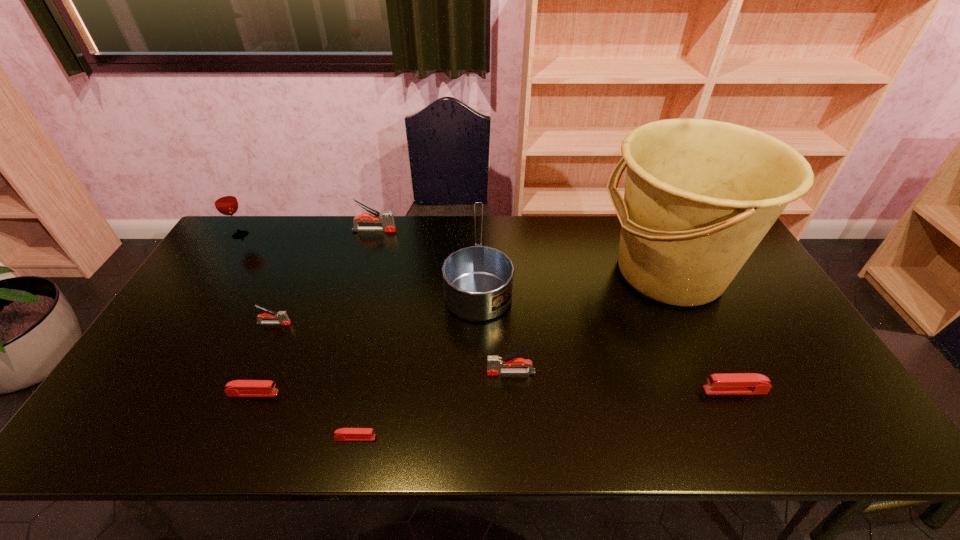
At what (x,y) coordinates should I click in order to perform the action: click on the seventh tallest object. Please return your answer as a coordinate pair (x, y). Looking at the image, I should click on (732, 383).

The image size is (960, 540). Identify the location of the biggest red stapler. (732, 383).

This screenshot has height=540, width=960. I want to click on the leftmost red stapler, so click(x=238, y=388).

At what (x,y) coordinates should I click in order to perform the action: click on the eighth tallest object. Please return your answer as a coordinate pair (x, y). The image size is (960, 540). Looking at the image, I should click on (238, 388).

Find the location of a particular element. The width and height of the screenshot is (960, 540). the shortest object is located at coordinates (343, 434).

Image resolution: width=960 pixels, height=540 pixels. Find the location of `the nearest red stapler`. the nearest red stapler is located at coordinates tap(343, 434).

Identify the location of vacant position located on the side of the tallest object with the handle. (497, 272).

I want to click on vacant space located 0.210m on the side of the tallest object with the handle, so click(529, 272).

At what (x,y) coordinates should I click in order to perform the action: click on vacant region located on the side of the tallest object with the handle. Please return your answer as a coordinate pair (x, y). The width and height of the screenshot is (960, 540). Looking at the image, I should click on (564, 272).

Identify the location of vacant area located 0.050m on the right of the glass. This screenshot has height=540, width=960. (265, 235).